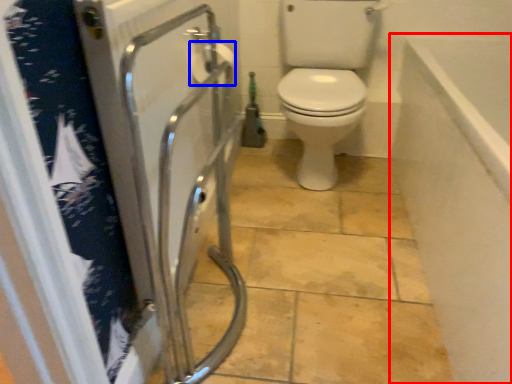
Question: Which object is further to the camera taking this photo, bath (highlighted by a red box) or toilet paper (highlighted by a blue box)?

Choices:
 (A) bath
 (B) toilet paper

Answer: (B)